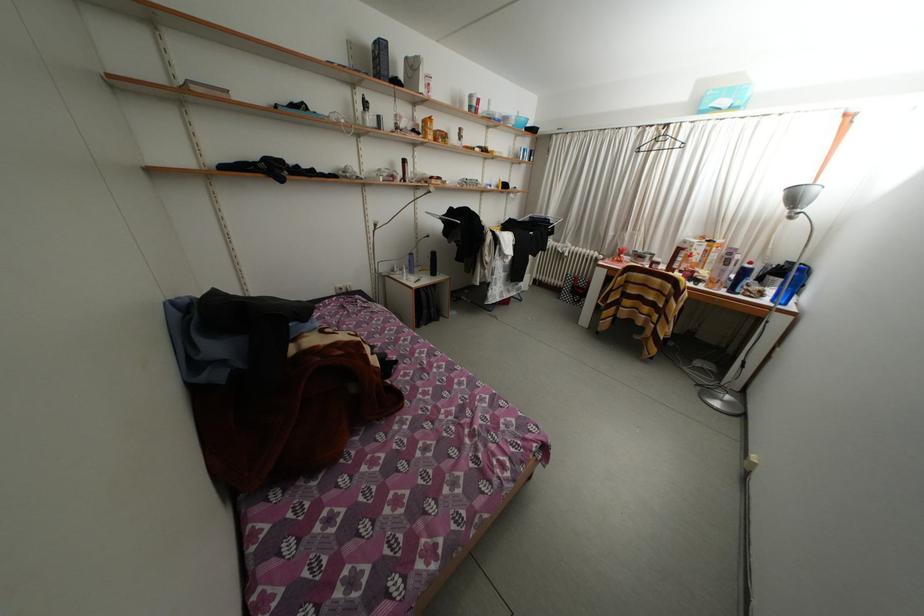
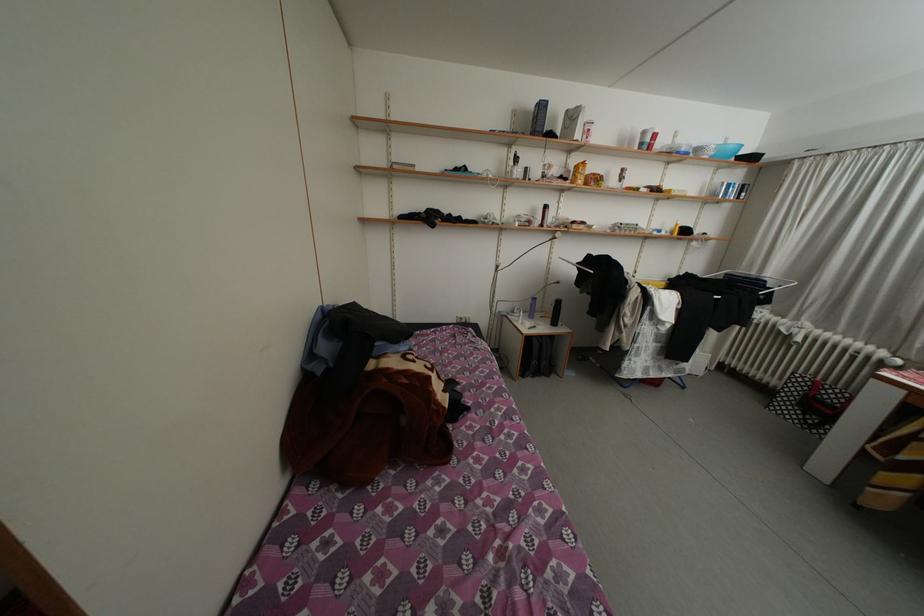
Where in the second image is the point corresponding to point 420,71 from the first image?

(580, 122)